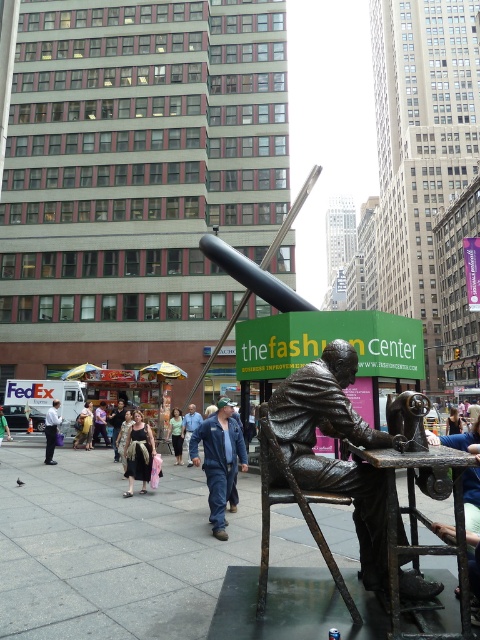
Is blue denim jacket at center above blue jeans at center?

Yes, blue denim jacket at center is above blue jeans at center.

Is blue denim jacket at center below blue jeans at center?

Actually, blue denim jacket at center is above blue jeans at center.

Where is `blue denim jacket at center`? blue denim jacket at center is located at coordinates pos(218,460).

Find the location of a particular element. blue denim jacket at center is located at coordinates (218, 460).

In the scene shown: Is bronze statue at center wider than matte black dress at center?

Correct, the width of bronze statue at center exceeds that of matte black dress at center.

Which is in front, point (409, 573) or point (140, 470)?

Point (409, 573) is in front.

What are the coordinates of `bronze statue at center` in the screenshot? It's located at (339, 438).

Measure the distance from bronze statue at center to blue jeans at center.

They are 9.95 meters apart.

Is bronze statue at center bigger than blue jeans at center?

Actually, bronze statue at center might be smaller than blue jeans at center.

What do you see at coordinates (339, 438) in the screenshot? The height and width of the screenshot is (640, 480). I see `bronze statue at center` at bounding box center [339, 438].

Find the location of `bronze statue at center`. bronze statue at center is located at coordinates (339, 438).